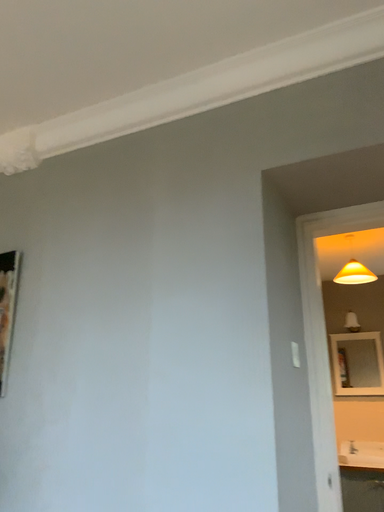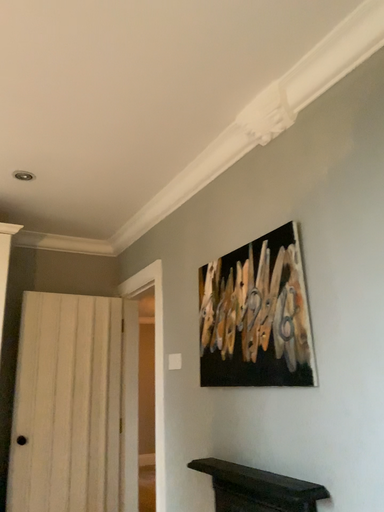
Question: Which way did the camera rotate in the video?

Choices:
 (A) rotated right
 (B) rotated left

Answer: (B)